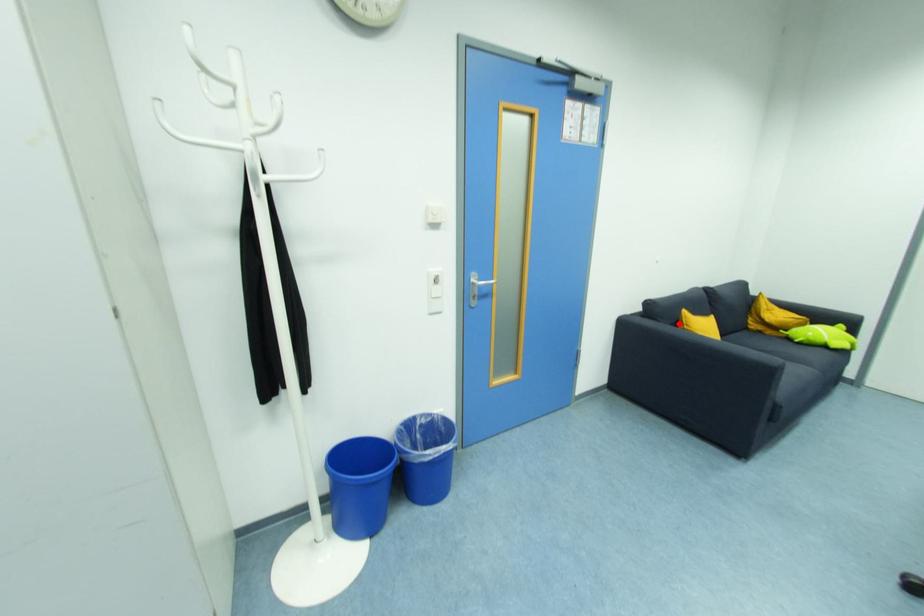
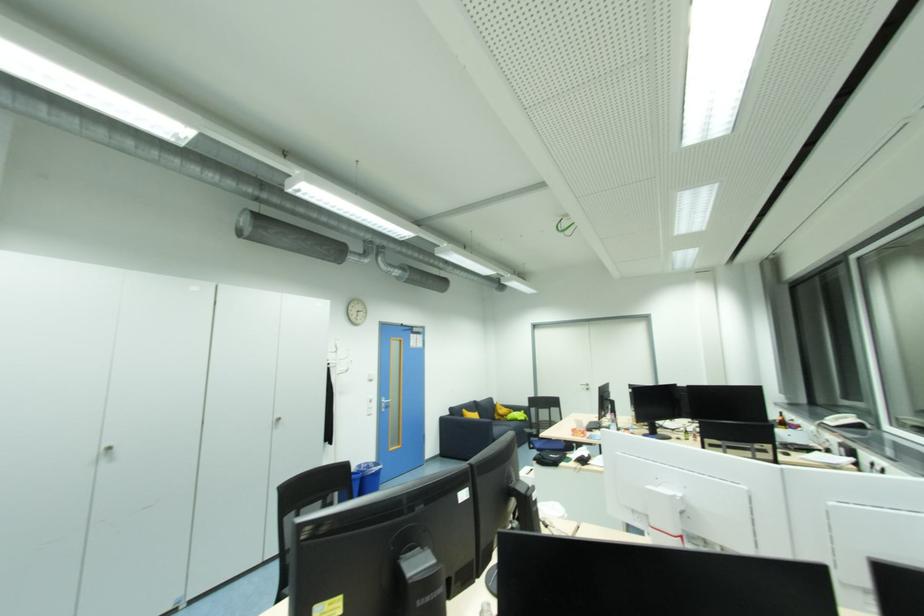
Question: I am providing you with two images of the same scene from different viewpoints. A red point is shown in image1. For the corresponding object point in image2, is it positioned nearer or farther from the camera?

Choices:
 (A) Nearer
 (B) Farther

Answer: (B)